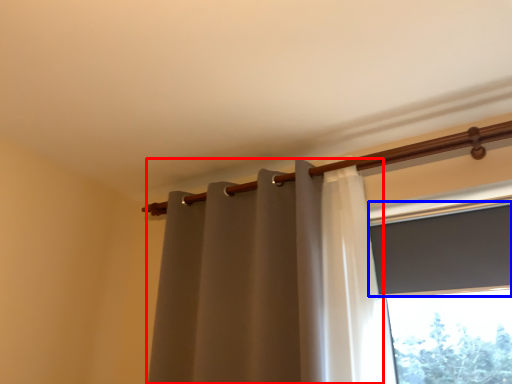
Question: Which object appears closest to the camera in this image, curtain (highlighted by a red box) or window screen (highlighted by a blue box)?

Choices:
 (A) curtain
 (B) window screen

Answer: (A)